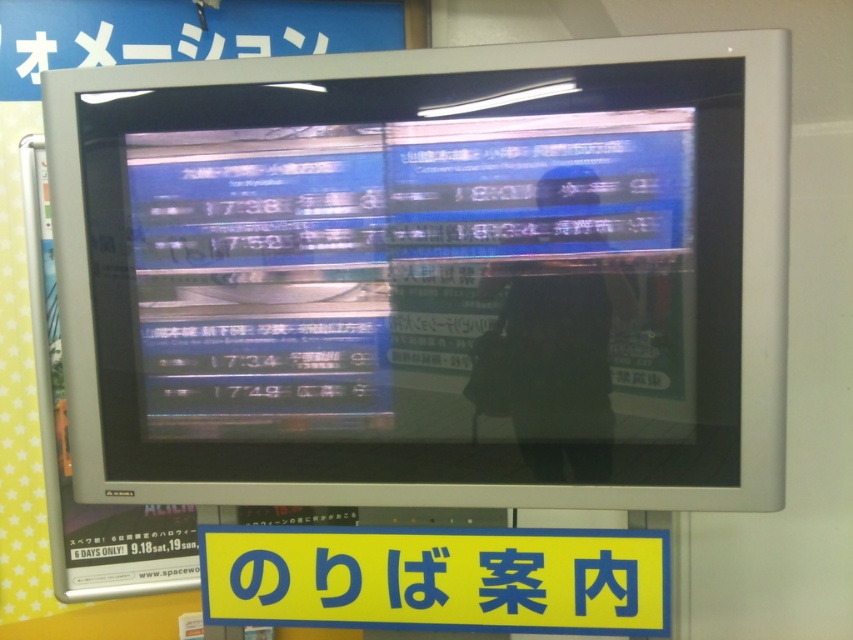
Is yellow matte sign at center smaller than dark gray fabric man at center?

Actually, yellow matte sign at center might be larger than dark gray fabric man at center.

Does yellow matte sign at center have a greater height compared to dark gray fabric man at center?

Incorrect, yellow matte sign at center's height is not larger of dark gray fabric man at center's.

Locate an element on the screen. The height and width of the screenshot is (640, 853). yellow matte sign at center is located at coordinates tap(437, 579).